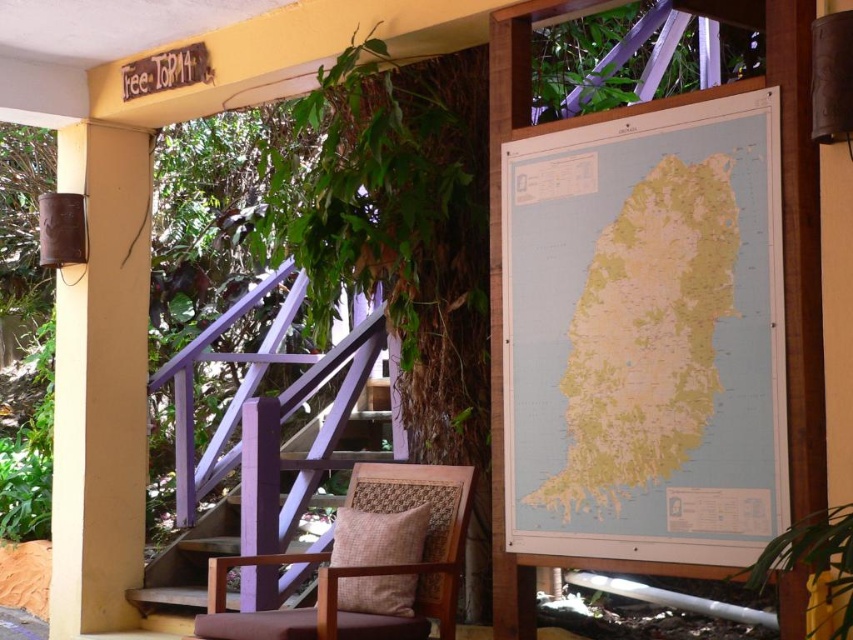
Question: Considering the real-world distances, which object is farthest from the purple wood stairs at center?

Choices:
 (A) brown woven armchair at center
 (B) light blue paper map at right

Answer: (B)

Question: In this image, where is purple wood stairs at center located relative to brown woven armchair at center?

Choices:
 (A) below
 (B) above

Answer: (A)

Question: Which point is closer to the camera?

Choices:
 (A) (686, 285)
 (B) (413, 477)

Answer: (A)

Question: Can you confirm if purple wood stairs at center is thinner than brown woven armchair at center?

Choices:
 (A) no
 (B) yes

Answer: (A)

Question: Which object appears farthest from the camera in this image?

Choices:
 (A) light blue paper map at right
 (B) brown woven armchair at center

Answer: (B)

Question: Can you confirm if light blue paper map at right is smaller than purple wood stairs at center?

Choices:
 (A) yes
 (B) no

Answer: (A)